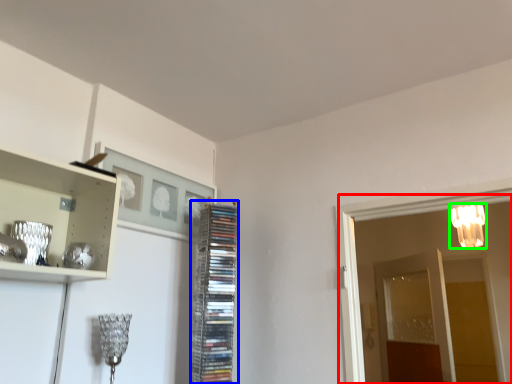
Question: Based on their relative distances, which object is nearer to glass door (highlighted by a red box)? Choose from cabinet (highlighted by a blue box) and lamp (highlighted by a green box).

Choices:
 (A) cabinet
 (B) lamp

Answer: (A)